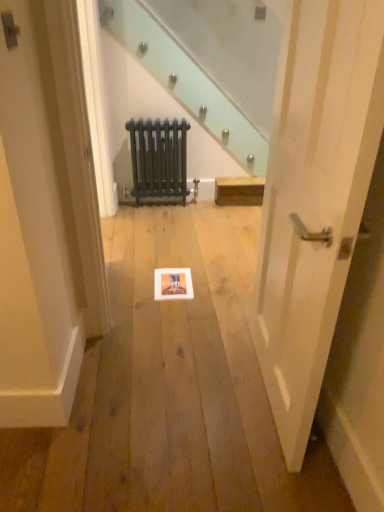
Locate an element on the screen. free space on the front side of matte black radiator at center is located at coordinates (160, 216).